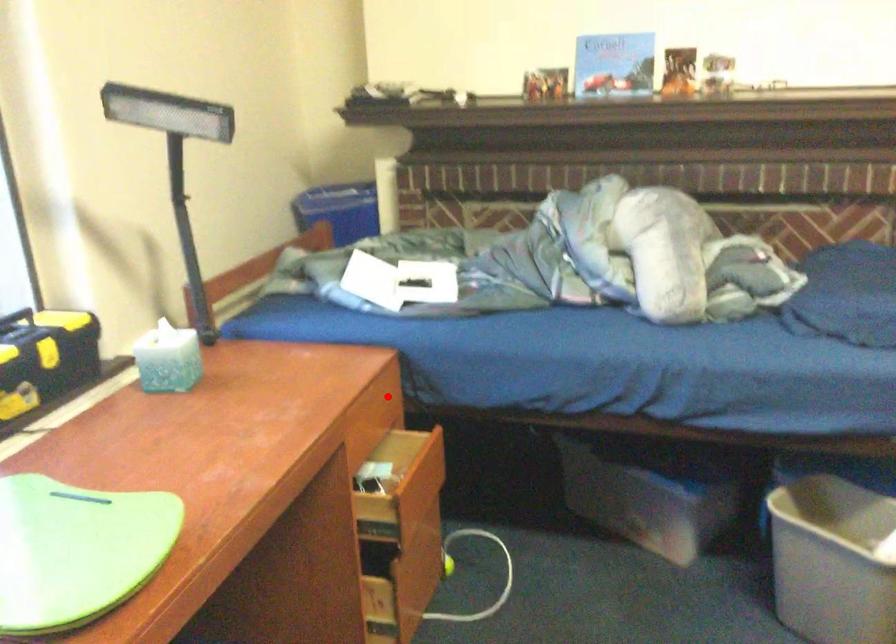
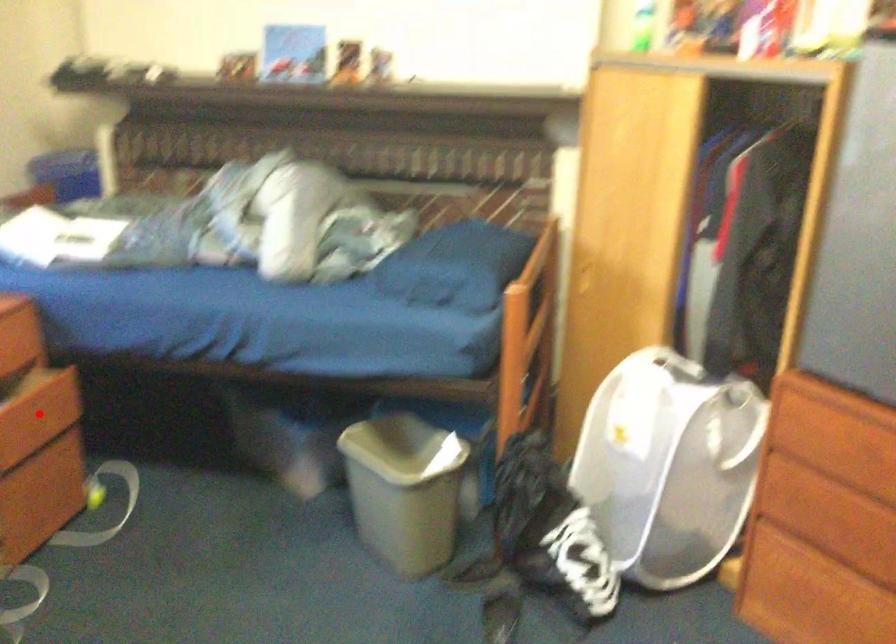
I am providing you with two images of the same scene from different viewpoints. A red point is marked on the first image and another point is marked on the second image. Do the highlighted points in image1 and image2 indicate the same real-world spot?

No